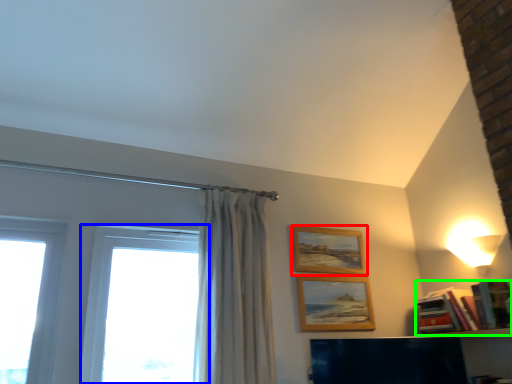
Question: Considering the real-world distances, which object is closest to picture frame (highlighted by a red box)? window (highlighted by a blue box) or book (highlighted by a green box).

Choices:
 (A) window
 (B) book

Answer: (B)